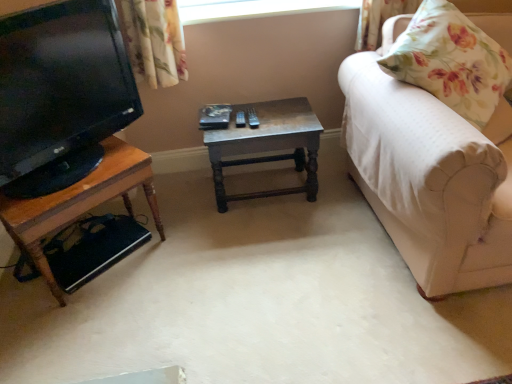
In order to click on free space on the front side of woodenobject at left, the 1th table positioned from the left in this screenshot , I will do `click(88, 322)`.